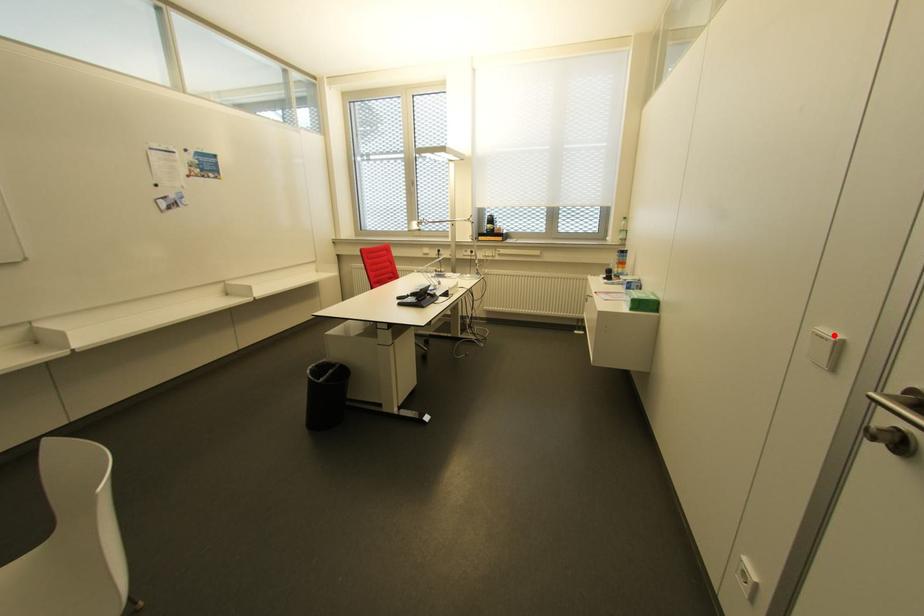
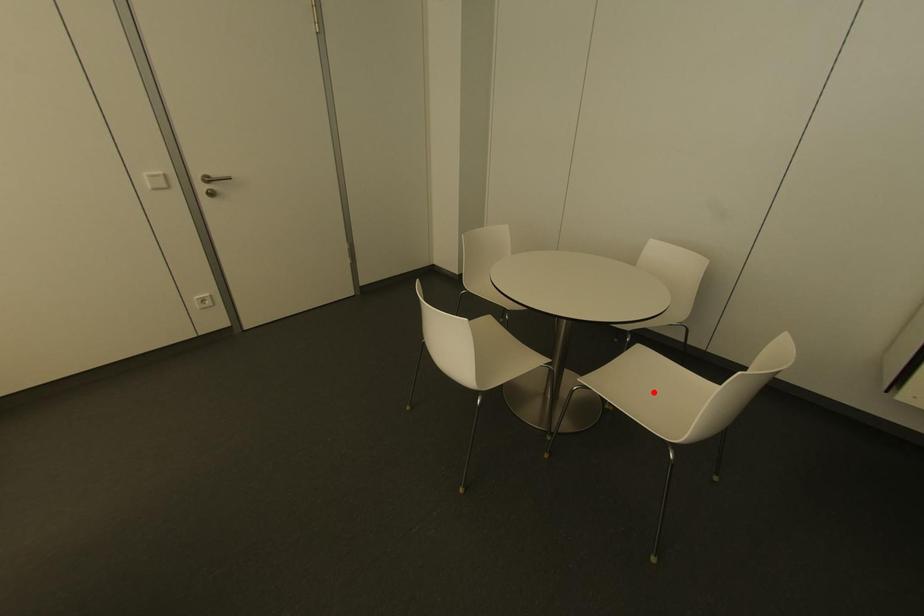
I am providing you with two images of the same scene from different viewpoints. A red point is marked on the first image and another point is marked on the second image. Is the marked point in image1 the same physical position as the marked point in image2?

No